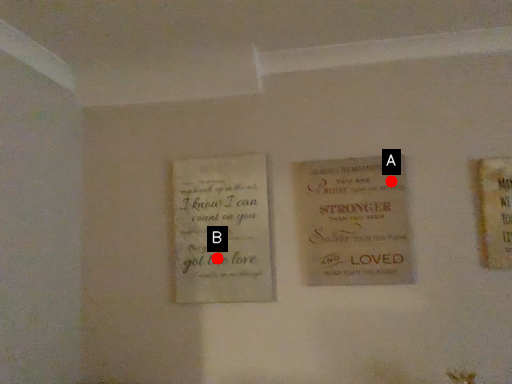
Question: Two points are circled on the image, labeled by A and B beside each circle. Which point is closer to the camera taking this photo?

Choices:
 (A) A is closer
 (B) B is closer

Answer: (A)